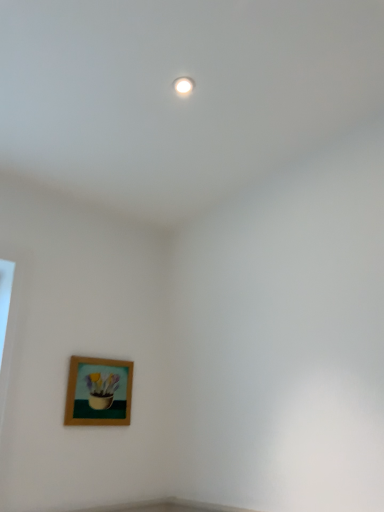
Identify the location of wooden frame at lower left. (99, 392).

Image resolution: width=384 pixels, height=512 pixels. Describe the element at coordinates (99, 392) in the screenshot. I see `wooden frame at lower left` at that location.

From the picture: Measure the distance between point (100, 397) and camera.

Point (100, 397) and camera are 6.66 feet apart from each other.

Find the location of `wooden frame at lower left`. wooden frame at lower left is located at coordinates (99, 392).